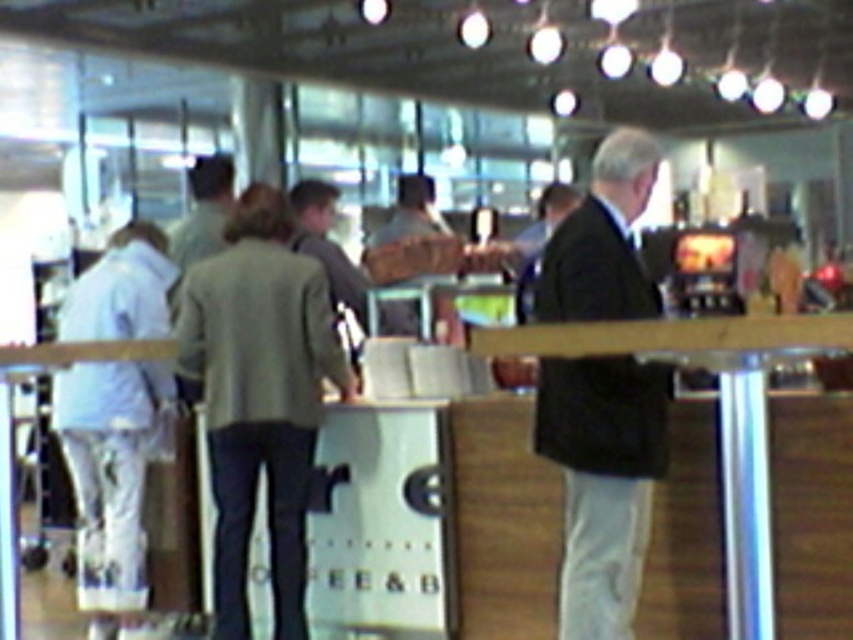
Who is positioned more to the left, dark suit jacket at center or white fabric pants at left?

Positioned to the left is white fabric pants at left.

Does point (608, 586) come farther from viewer compared to point (138, 547)?

No, it is not.

Identify the location of dark suit jacket at center. The height and width of the screenshot is (640, 853). (602, 481).

Can you confirm if green wool jacket at center is positioned above white fabric pants at left?

Indeed, green wool jacket at center is positioned over white fabric pants at left.

Is point (283, 488) positioned after point (115, 460)?

No, it is in front of (115, 460).

Find the location of a particular element. This screenshot has height=640, width=853. green wool jacket at center is located at coordinates (259, 396).

Identify the location of green wool jacket at center. Image resolution: width=853 pixels, height=640 pixels. (259, 396).

I want to click on green wool jacket at center, so click(x=259, y=396).

Is green wool jacket at center smaller than dark suit jacket at center?

No, green wool jacket at center is not smaller than dark suit jacket at center.

This screenshot has width=853, height=640. What do you see at coordinates (259, 396) in the screenshot?
I see `green wool jacket at center` at bounding box center [259, 396].

I want to click on green wool jacket at center, so click(x=259, y=396).